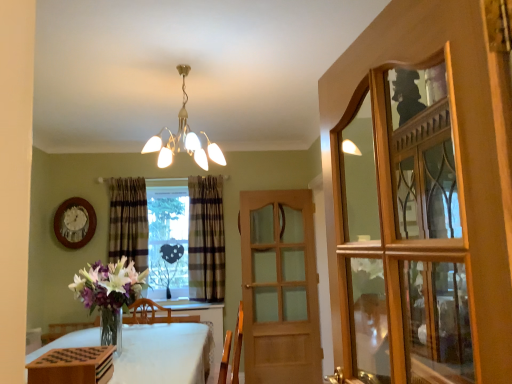
How much space does plaid fabric curtain at center, which is the 1th curtain in left-to-right order, occupy horizontally?

It is 8.51 inches.

Where is `wooden clock at upper left`? The width and height of the screenshot is (512, 384). wooden clock at upper left is located at coordinates (74, 223).

Measure the distance between wooden clock at upper left and camera.

4.25 meters.

Identify the location of white cloth-covered table at lower left. This screenshot has width=512, height=384. (164, 354).

The width and height of the screenshot is (512, 384). I want to click on plaid fabric curtain at center, which appears as the 2th curtain when viewed from the right, so click(128, 221).

Can you confirm if metallic chandelier at upper center is positioned to the right of wooden glass cabinet at right?

In fact, metallic chandelier at upper center is to the left of wooden glass cabinet at right.

From the image's perspective, which one is positioned higher, metallic chandelier at upper center or wooden glass cabinet at right?

From the image's view, metallic chandelier at upper center is above.

Is metallic chandelier at upper center wider or thinner than wooden glass cabinet at right?

In the image, metallic chandelier at upper center appears to be wider than wooden glass cabinet at right.

How many degrees apart are the facing directions of metallic chandelier at upper center and wooden glass cabinet at right?

9.62 degrees separate the facing orientations of metallic chandelier at upper center and wooden glass cabinet at right.

Which of these two, plaid fabric curtain at center, the 2th curtain positioned from the left, or metallic chandelier at upper center, stands shorter?

With less height is metallic chandelier at upper center.

From the image's perspective, which one is positioned higher, plaid fabric curtain at center, the 2th curtain positioned from the left, or metallic chandelier at upper center?

From the image's view, metallic chandelier at upper center is above.

Which of these two, plaid fabric curtain at center, which ranks as the 1th curtain in right-to-left order, or metallic chandelier at upper center, is bigger?

Bigger between the two is plaid fabric curtain at center, which ranks as the 1th curtain in right-to-left order.

Is metallic chandelier at upper center located within plaid fabric curtain at center, the 2th curtain positioned from the left?

No.

From a real-world perspective, relative to white cloth-covered table at lower left, is light brown wooden door at center vertically above or below?

light brown wooden door at center is situated higher than white cloth-covered table at lower left in the real world.

Are light brown wooden door at center and white cloth-covered table at lower left located far from each other?

Yes, light brown wooden door at center and white cloth-covered table at lower left are located far from each other.

Considering the relative sizes of light brown wooden door at center and white cloth-covered table at lower left in the image provided, is light brown wooden door at center taller than white cloth-covered table at lower left?

Indeed, light brown wooden door at center has a greater height compared to white cloth-covered table at lower left.

Consider the image. Can you tell me how much light brown wooden door at center and white cloth-covered table at lower left differ in facing direction?

light brown wooden door at center and white cloth-covered table at lower left are facing 178 degrees away from each other.

From the image's perspective, does clear glass heart at center appear lower than light brown wooden door at center?

Incorrect, from the image's perspective, clear glass heart at center is higher than light brown wooden door at center.

Could you tell me if clear glass heart at center is turned towards light brown wooden door at center?

No, clear glass heart at center is not facing towards light brown wooden door at center.

Consider the image. How different are the orientations of clear glass heart at center and light brown wooden door at center in degrees?

They differ by 0.882 degrees in their facing directions.

Would you consider clear glass heart at center to be distant from light brown wooden door at center?

No, clear glass heart at center is not far away from light brown wooden door at center.

There is a plaid fabric curtain at center, which ranks as the 1th curtain in right-to-left order. Where is `curtain above it (from a real-world perspective)`? curtain above it (from a real-world perspective) is located at coordinates (128, 221).

Is plaid fabric curtain at center, which is the 1th curtain in left-to-right order, directly adjacent to plaid fabric curtain at center, the 2th curtain positioned from the left?

plaid fabric curtain at center, which is the 1th curtain in left-to-right order, and plaid fabric curtain at center, the 2th curtain positioned from the left, are clearly separated.

Is point (121, 249) closer to viewer compared to point (189, 206)?

Yes, point (121, 249) is in front of point (189, 206).

Which object is thinner, plaid fabric curtain at center, which is the 1th curtain in left-to-right order, or plaid fabric curtain at center, which ranks as the 1th curtain in right-to-left order?

plaid fabric curtain at center, which is the 1th curtain in left-to-right order.

Considering the relative positions of metallic chandelier at upper center and white cloth-covered table at lower left in the image provided, is metallic chandelier at upper center to the left of white cloth-covered table at lower left from the viewer's perspective?

No, metallic chandelier at upper center is not to the left of white cloth-covered table at lower left.

Is metallic chandelier at upper center wider than white cloth-covered table at lower left?

No.

From the image's perspective, which is above, metallic chandelier at upper center or white cloth-covered table at lower left?

metallic chandelier at upper center is shown above in the image.

Identify the location of table below the metallic chandelier at upper center (from the image's perspective). The height and width of the screenshot is (384, 512). (164, 354).

Consider the image. Who is smaller, light brown wooden door at center or wooden glass cabinet at right?

wooden glass cabinet at right.

From a real-world perspective, between light brown wooden door at center and wooden glass cabinet at right, who is vertically higher?

wooden glass cabinet at right is physically above.

Does light brown wooden door at center appear on the right side of wooden glass cabinet at right?

No, light brown wooden door at center is not to the right of wooden glass cabinet at right.

From the image's perspective, is light brown wooden door at center under wooden glass cabinet at right?

Yes.

Locate an element on the screen. The height and width of the screenshot is (384, 512). glass door to the right of metallic chandelier at upper center is located at coordinates (403, 229).

You are a GUI agent. You are given a task and a screenshot of the screen. Output one action in this format:
    pyautogui.click(x=<x>, y=<y>)
    Task: Click on the lamp in front of the plaid fabric curtain at center, the 2th curtain positioned from the left
    
    Given the screenshot: What is the action you would take?
    pyautogui.click(x=183, y=138)

Based on their spatial positions, is plaid fabric curtain at center, which is the 1th curtain in left-to-right order, or light brown wooden door at center closer to white cloth-covered table at lower left?

Based on the image, light brown wooden door at center appears to be nearer to white cloth-covered table at lower left.

Based on their spatial positions, is metallic chandelier at upper center or clear glass heart at center closer to wooden clock at upper left?

clear glass heart at center lies closer to wooden clock at upper left than the other object.

Looking at the image, which one is located further to white cloth-covered table at lower left, clear glass heart at center or plaid fabric curtain at center, the 2th curtain positioned from the left?

clear glass heart at center.

In the scene shown: From the image, which object appears to be nearer to plaid fabric curtain at center, which ranks as the 1th curtain in right-to-left order, plaid fabric curtain at center, which is the 1th curtain in left-to-right order, or white cloth-covered table at lower left?

plaid fabric curtain at center, which is the 1th curtain in left-to-right order.

Based on their spatial positions, is plaid fabric curtain at center, the 2th curtain positioned from the left, or metallic chandelier at upper center closer to plaid fabric curtain at center, which appears as the 2th curtain when viewed from the right?

plaid fabric curtain at center, the 2th curtain positioned from the left, lies closer to plaid fabric curtain at center, which appears as the 2th curtain when viewed from the right, than the other object.

From the image, which object appears to be farther from light brown wooden door at center, plaid fabric curtain at center, the 2th curtain positioned from the left, or white cloth-covered table at lower left?

white cloth-covered table at lower left is further to light brown wooden door at center.

Estimate the real-world distances between objects in this image. Which object is closer to clear glass heart at center, wooden glass cabinet at right or metallic chandelier at upper center?

The object closer to clear glass heart at center is metallic chandelier at upper center.

Based on their spatial positions, is plaid fabric curtain at center, which ranks as the 1th curtain in right-to-left order, or clear glass heart at center closer to metallic chandelier at upper center?

plaid fabric curtain at center, which ranks as the 1th curtain in right-to-left order, is closer to metallic chandelier at upper center.

What are the coordinates of `door between wooden glass cabinet at right and plaid fabric curtain at center, which is the 1th curtain in left-to-right order, from front to back` in the screenshot? It's located at (279, 287).

The image size is (512, 384). Identify the location of table between wooden glass cabinet at right and plaid fabric curtain at center, which is the 1th curtain in left-to-right order, along the z-axis. (164, 354).

Identify the location of curtain between white cloth-covered table at lower left and plaid fabric curtain at center, the 2th curtain positioned from the left, in the front-back direction. 128,221.

At what (x,y) coordinates should I click in order to perform the action: click on door positioned between metallic chandelier at upper center and plaid fabric curtain at center, which is the 1th curtain in left-to-right order, from near to far. Please return your answer as a coordinate pair (x, y). Image resolution: width=512 pixels, height=384 pixels. Looking at the image, I should click on (279, 287).